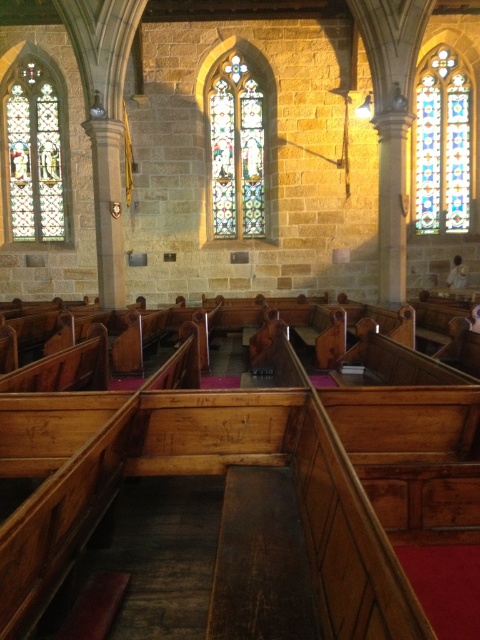
You are an architect designing a new church and want to replicate the stained glass window patterns. You observe the stained glass window at left and the stained glass window at center in this image. Which one should you choose if you want a window that is taller?

The stained glass window at left is taller than the stained glass window at center, so you should choose the stained glass window at left for a taller window.

You are standing at the entrance of the church and want to locate the stained glass window at upper right. According to the coordinate system where the bottom left corner is the origin, can you tell me its position?

The stained glass window at upper right is located at point (443, 145).